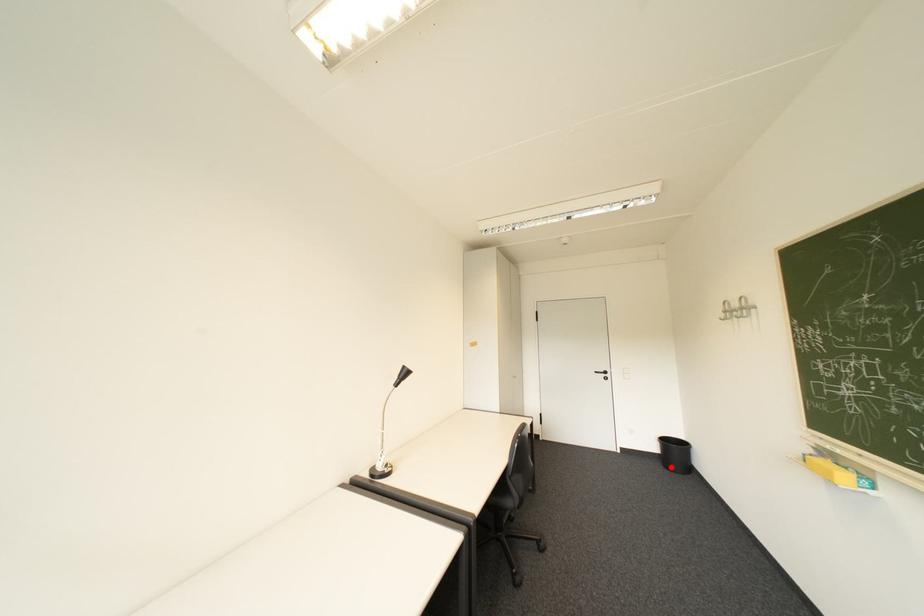
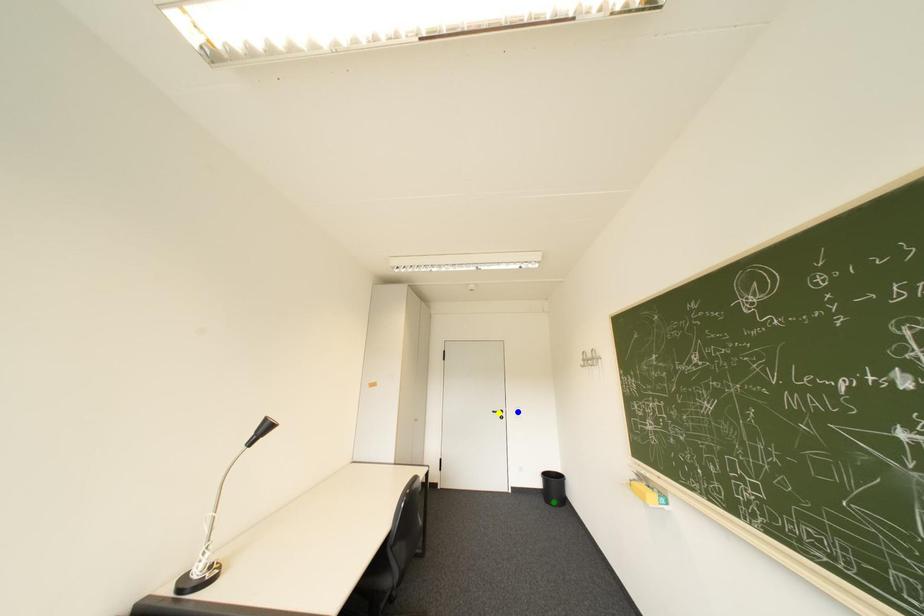
Question: I am providing you with two images of the same scene from different viewpoints. A red point is marked on the first image. You are given multiple points on the second image. Can you choose the point in image 2 that corresponds to the point in image 1?

Choices:
 (A) blue point
 (B) yellow point
 (C) green point

Answer: (C)